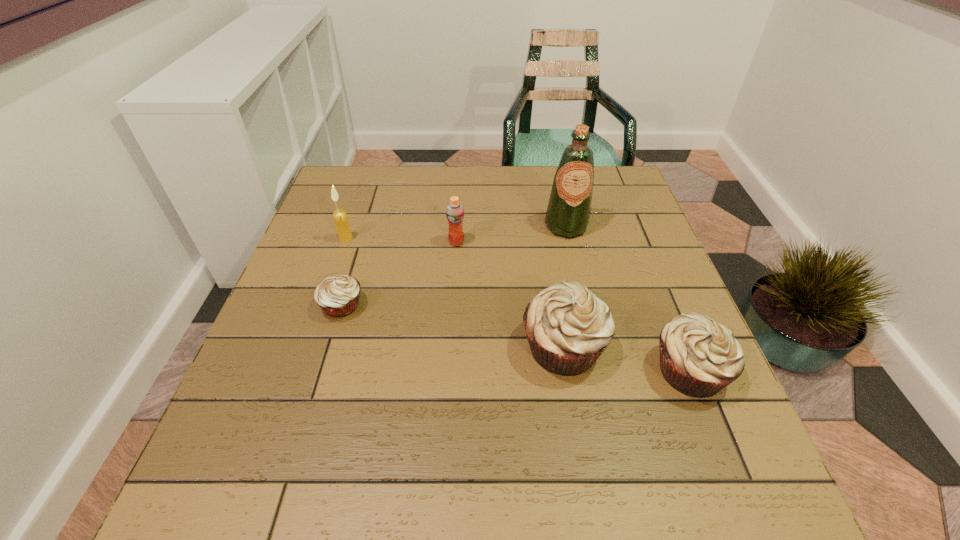
Locate an element on the screen. The image size is (960, 540). vacant space located on the back of the second tallest muffin is located at coordinates (641, 252).

Identify the location of vacant space situated on the front-facing side of the tallest object. This screenshot has height=540, width=960. (599, 370).

This screenshot has width=960, height=540. What are the coordinates of `vacant area situated 0.080m on the right of the candle` in the screenshot? It's located at (383, 239).

Find the location of a particular element. vacant space located 0.370m on the left of the orange juice is located at coordinates (304, 242).

This screenshot has width=960, height=540. In order to click on object located in the near edge section of the desktop in this screenshot , I will do `click(698, 357)`.

What are the coordinates of `muffin located at the left edge` in the screenshot? It's located at (338, 296).

Locate an element on the screen. The width and height of the screenshot is (960, 540). candle that is at the left edge is located at coordinates (340, 217).

This screenshot has height=540, width=960. What are the coordinates of `muffin at the right edge` in the screenshot? It's located at (698, 357).

Find the location of a particular element. This screenshot has width=960, height=540. olive oil that is at the right edge is located at coordinates (568, 212).

Locate an element on the screen. The image size is (960, 540). object positioned at the near right corner is located at coordinates (698, 357).